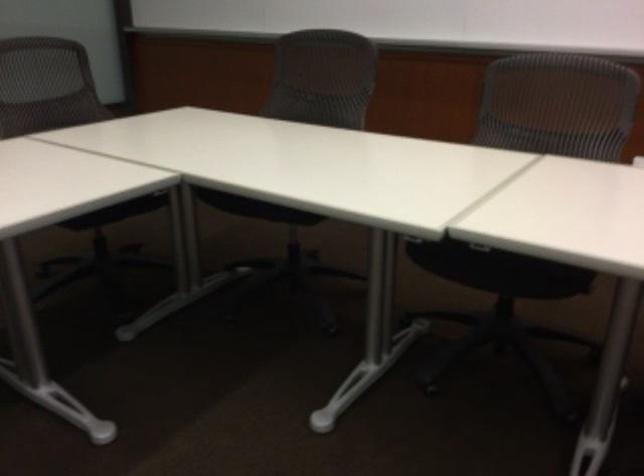
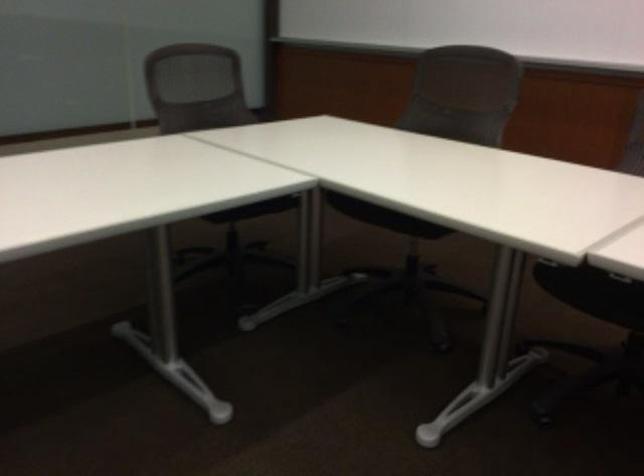
Find the pixel in the second image that matches the point at 120,211 in the first image.

(254, 209)